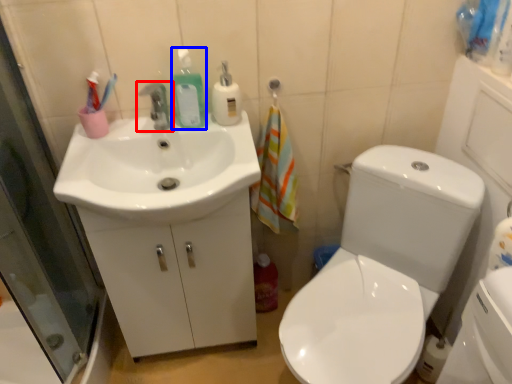
Question: Which object is further to the camera taking this photo, tap (highlighted by a red box) or cleaning product (highlighted by a blue box)?

Choices:
 (A) tap
 (B) cleaning product

Answer: (B)